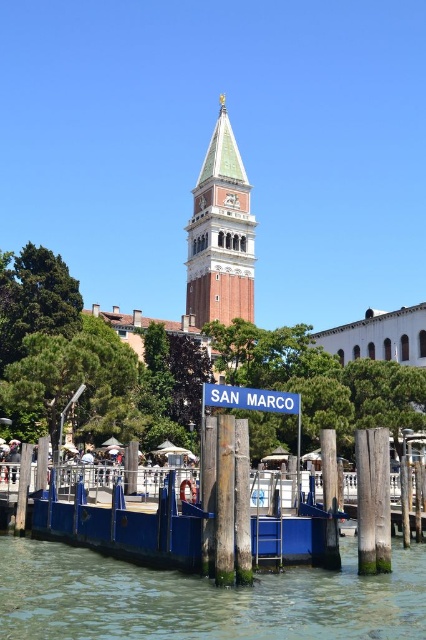
Question: Which point is farther to the camera?

Choices:
 (A) white plastic street sign at center
 (B) green copper bell tower at center
 (C) clear water at lower center

Answer: (B)

Question: Which is nearer to the clear water at lower center?

Choices:
 (A) white plastic street sign at center
 (B) green copper bell tower at center

Answer: (A)

Question: Based on their relative distances, which object is nearer to the white plastic street sign at center?

Choices:
 (A) clear water at lower center
 (B) green copper bell tower at center

Answer: (A)

Question: Can you confirm if clear water at lower center is wider than white plastic street sign at center?

Choices:
 (A) no
 (B) yes

Answer: (B)

Question: Does clear water at lower center have a larger size compared to green copper bell tower at center?

Choices:
 (A) yes
 (B) no

Answer: (B)

Question: From the image, what is the correct spatial relationship of clear water at lower center in relation to green copper bell tower at center?

Choices:
 (A) below
 (B) above

Answer: (A)